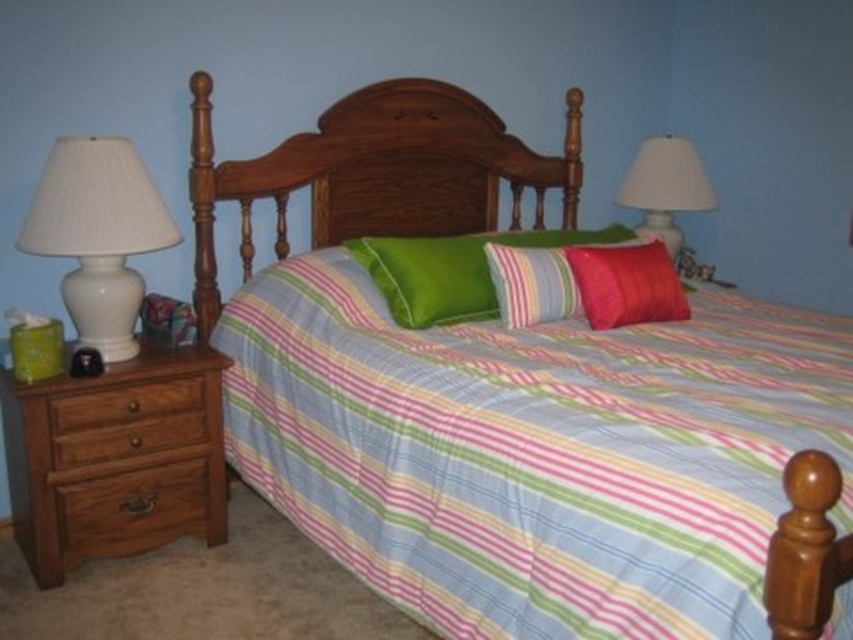
Question: Which object is farther from the camera taking this photo?

Choices:
 (A) brown wood drawer at lower left
 (B) brown wood drawer at left
 (C) brown wooden drawer at left

Answer: (A)

Question: Does brown wood dresser at left appear over brown wooden drawer at left?

Choices:
 (A) no
 (B) yes

Answer: (A)

Question: Considering the relative positions of brown wood dresser at left and striped fabric pillow at center in the image provided, where is brown wood dresser at left located with respect to striped fabric pillow at center?

Choices:
 (A) right
 (B) left

Answer: (B)

Question: Which of the following is the closest to the observer?

Choices:
 (A) (74, 269)
 (B) (548, 280)

Answer: (A)

Question: Which is nearer to the striped fabric pillow at center?

Choices:
 (A) brown wood dresser at left
 (B) white ceramic lamp at upper right
 (C) silky red pillow at center

Answer: (C)

Question: Does brown wood dresser at left have a greater width compared to silky red pillow at center?

Choices:
 (A) no
 (B) yes

Answer: (B)